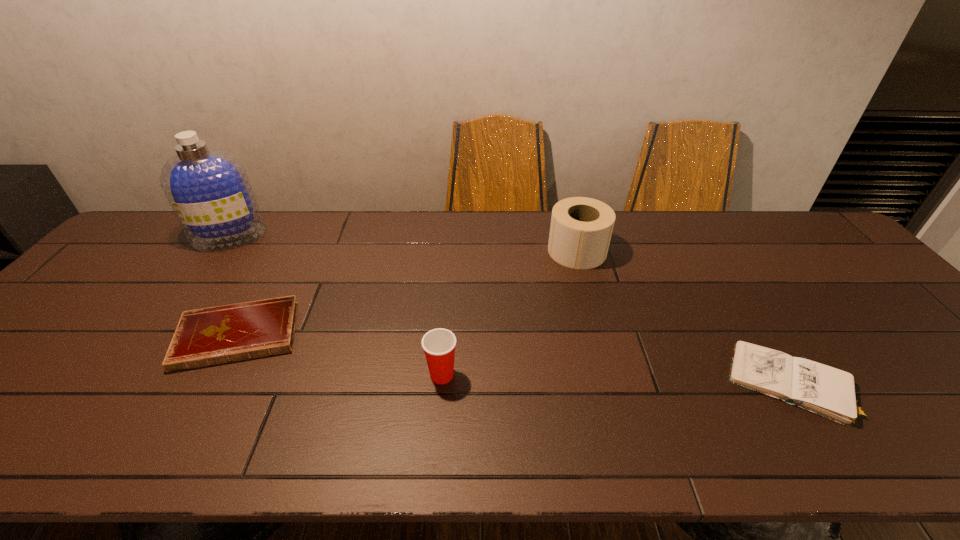
You are a GUI agent. You are given a task and a screenshot of the screen. Output one action in this format:
    pyautogui.click(x=<x>, y=<y>)
    Task: Click on the free spot between the left notebook and the tallest object
    Image resolution: width=960 pixels, height=540 pixels.
    Given the screenshot: What is the action you would take?
    pyautogui.click(x=234, y=286)

You are a GUI agent. You are given a task and a screenshot of the screen. Output one action in this format:
    pyautogui.click(x=<x>, y=<y>)
    Task: Click on the vacant space that's between the left notebook and the tallest object
    
    Given the screenshot: What is the action you would take?
    pyautogui.click(x=234, y=286)

Locate an element on the screen. This screenshot has width=960, height=540. vacant point located between the Dixie cup and the cleansing agent is located at coordinates (336, 306).

Identify the location of blank region between the tallest object and the left notebook. (234, 286).

Find the location of a particular element. This screenshot has height=540, width=960. vacant area that lies between the toilet tissue and the right notebook is located at coordinates (684, 317).

Where is `free space between the third tallest object and the right notebook`? This screenshot has width=960, height=540. free space between the third tallest object and the right notebook is located at coordinates (615, 379).

Where is `unoccupied area between the cleansing agent and the rightmost object`? unoccupied area between the cleansing agent and the rightmost object is located at coordinates (510, 309).

Where is `free space between the third tallest object and the right notebook`? The image size is (960, 540). free space between the third tallest object and the right notebook is located at coordinates (615, 379).

At what (x,y) coordinates should I click in order to perform the action: click on vacant space in between the cleansing agent and the Dixie cup. Please return your answer as a coordinate pair (x, y). The height and width of the screenshot is (540, 960). Looking at the image, I should click on (336, 306).

Point out which object is positioned as the fourth nearest to the second tallest object. Please provide its 2D coordinates. Your answer should be formatted as a tuple, i.e. [(x, y)], where the tuple contains the x and y coordinates of a point satisfying the conditions above.

[(208, 189)]